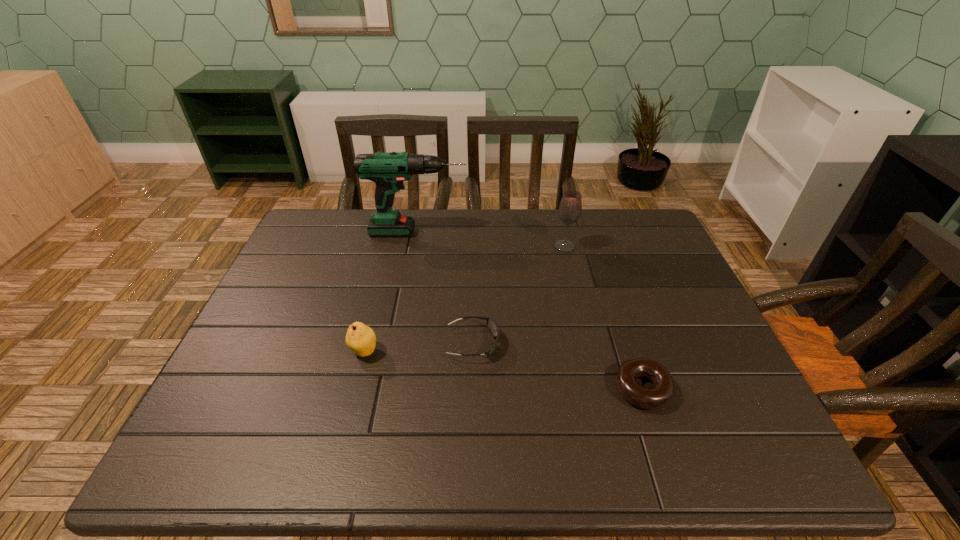
Identify the location of free location located on the front of the third tallest object. This screenshot has height=540, width=960. (351, 401).

I want to click on vacant space located 0.220m on the back of the rightmost object, so click(x=613, y=298).

Locate an element on the screen. The height and width of the screenshot is (540, 960). free space located on the lenses of the goggles is located at coordinates (639, 343).

Where is `drill located in the far edge section of the desktop`? drill located in the far edge section of the desktop is located at coordinates (388, 170).

The height and width of the screenshot is (540, 960). Find the location of `glass drink container that is at the far edge`. glass drink container that is at the far edge is located at coordinates (570, 208).

The width and height of the screenshot is (960, 540). I want to click on object that is at the right edge, so click(x=655, y=397).

At what (x,y) coordinates should I click in order to perform the action: click on free space at the far edge. Please return your answer as a coordinate pair (x, y). The width and height of the screenshot is (960, 540). Looking at the image, I should click on (370, 208).

I want to click on vacant space at the near edge of the desktop, so click(556, 460).

This screenshot has height=540, width=960. In the image, there is a desktop. Identify the location of free space at the left edge. (300, 327).

This screenshot has height=540, width=960. In the image, there is a desktop. What are the coordinates of `vacant area at the right edge` in the screenshot? It's located at (679, 293).